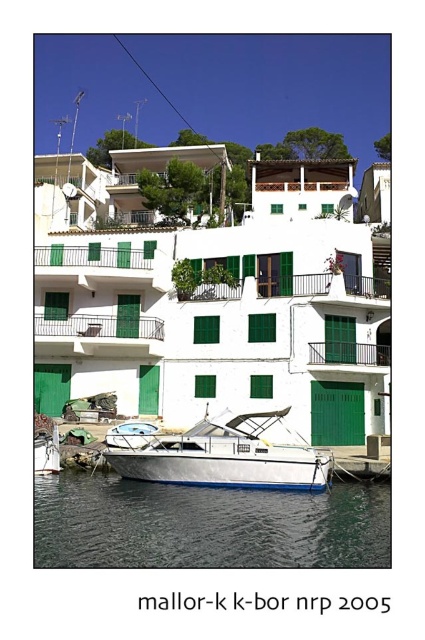
Is point (294, 561) behind point (385, 353)?

No, (294, 561) is closer to viewer.

Is transparent blue water at lower center bigger than green metal balcony at center?

Yes, transparent blue water at lower center is bigger than green metal balcony at center.

Between point (365, 499) and point (314, 358), which one is positioned behind?

The point (314, 358) is more distant.

At what (x,y) coordinates should I click in order to perform the action: click on transparent blue water at lower center. Please return your answer as a coordinate pair (x, y). The image size is (425, 640). Looking at the image, I should click on (206, 524).

Who is positioned more to the right, transparent blue water at lower center or white glossy boat at lower center?

From the viewer's perspective, white glossy boat at lower center appears more on the right side.

Is transparent blue water at lower center to the left of white glossy boat at lower center from the viewer's perspective?

Indeed, transparent blue water at lower center is positioned on the left side of white glossy boat at lower center.

Who is more distant from viewer, [285,536] or [260,426]?

Positioned behind is point [260,426].

The height and width of the screenshot is (640, 425). I want to click on transparent blue water at lower center, so click(x=206, y=524).

The width and height of the screenshot is (425, 640). Identify the location of white glossy boat at lower center. (227, 456).

Looking at this image, is white glossy boat at lower center taller than green metal balcony at center?

Yes.

At what (x,y) coordinates should I click in order to perform the action: click on white glossy boat at lower center. Please return your answer as a coordinate pair (x, y). Image resolution: width=425 pixels, height=640 pixels. Looking at the image, I should click on (227, 456).

Find the location of a particular element. This screenshot has width=425, height=640. white glossy boat at lower center is located at coordinates (227, 456).